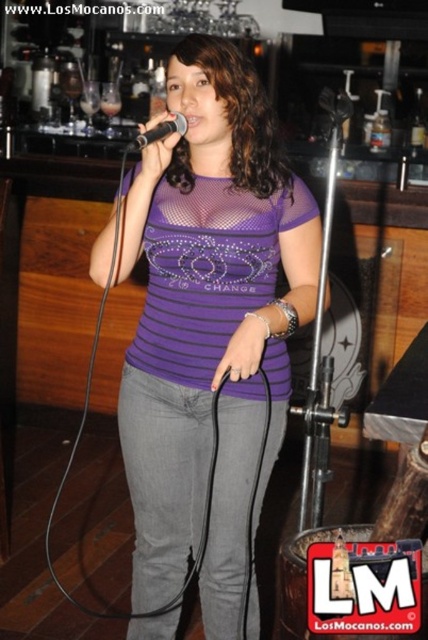
Question: Observing the image, what is the correct spatial positioning of purple mesh shirt at center in reference to black matte microphone at center?

Choices:
 (A) above
 (B) below

Answer: (B)

Question: Among these objects, which one is farthest from the camera?

Choices:
 (A) purple mesh shirt at center
 (B) black matte microphone at center

Answer: (A)

Question: Can you confirm if purple mesh shirt at center is positioned to the right of black matte microphone at center?

Choices:
 (A) no
 (B) yes

Answer: (B)

Question: Is purple mesh shirt at center behind black matte microphone at center?

Choices:
 (A) no
 (B) yes

Answer: (B)